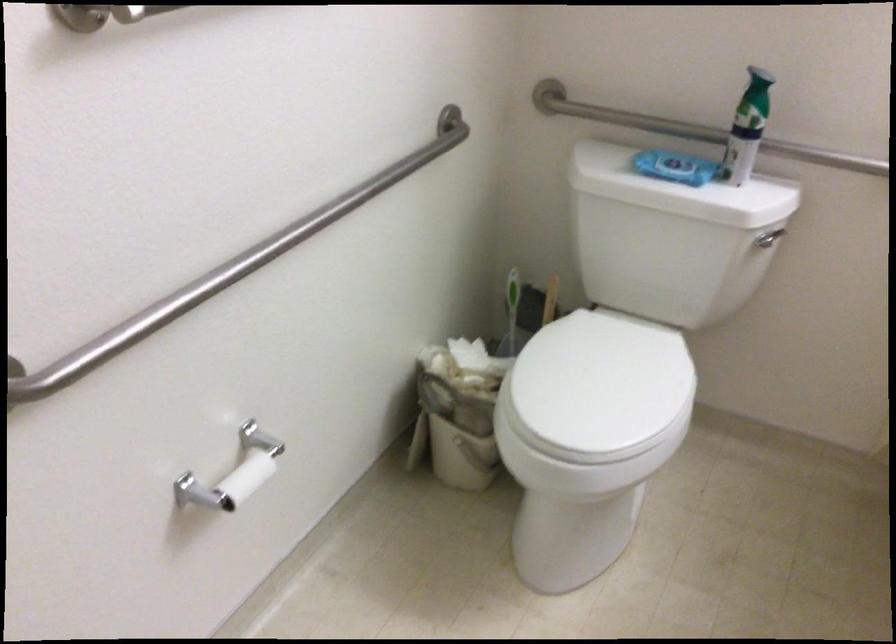
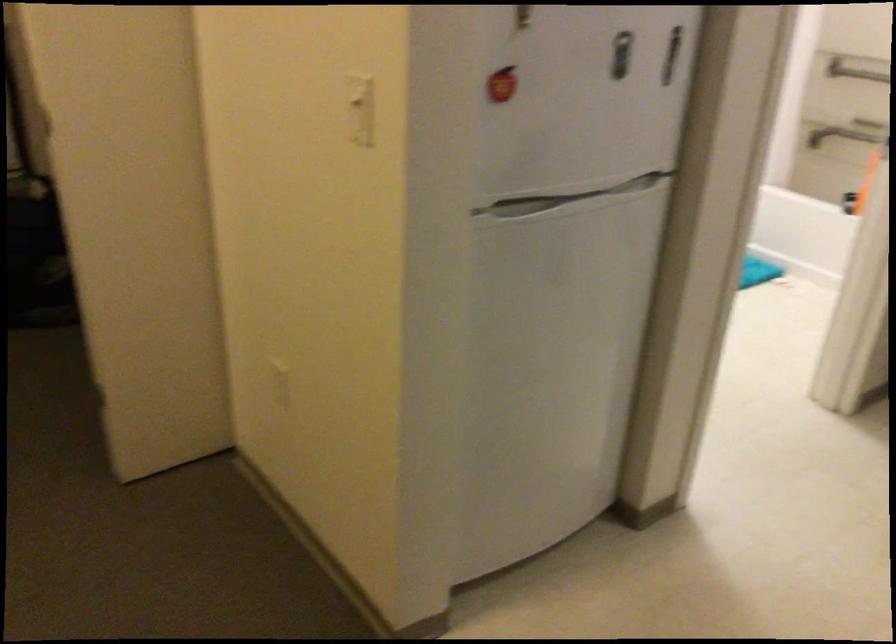
Question: I am providing you with two images of the same scene from different viewpoints. Which of the following objects are not visible in image2?

Choices:
 (A) refrigerator handle
 (B) white light switch
 (C) red and white hula-hoop
 (D) small white bucket

Answer: (D)